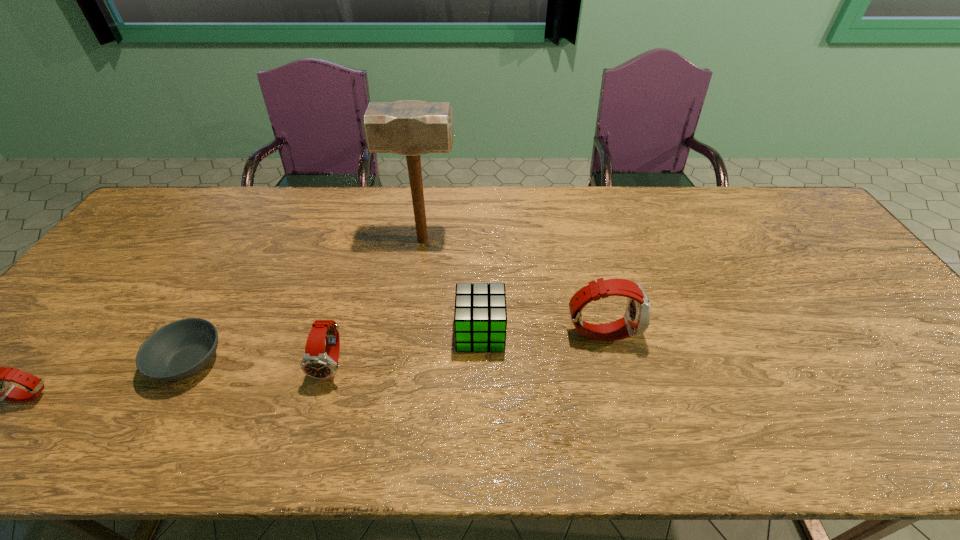
Please point a spot on the right to add another watch. Please provide its 2D coordinates. Your answer should be formatted as a tuple, i.e. [(x, y)], where the tuple contains the x and y coordinates of a point satisfying the conditions above.

[(837, 304)]